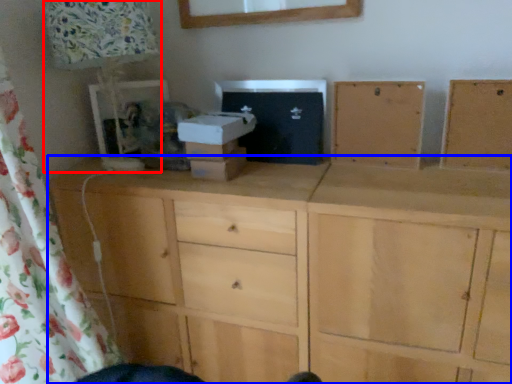
Question: Among these objects, which one is nearest to the camera, table lamp (highlighted by a red box) or chest of drawers (highlighted by a blue box)?

Choices:
 (A) table lamp
 (B) chest of drawers

Answer: (B)